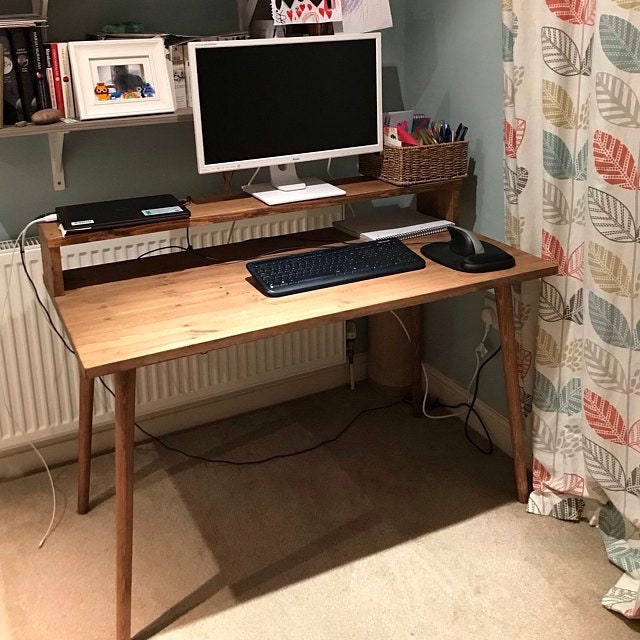
The image size is (640, 640). What are the coordinates of `keyboard` in the screenshot? It's located at (278, 267).